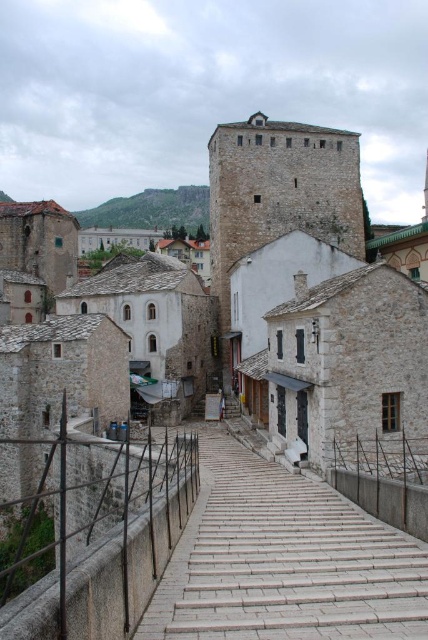
Question: Among these points, which one is nearest to the camera?

Choices:
 (A) pos(211,272)
 (B) pos(213,627)
 (C) pos(136,225)

Answer: (B)

Question: In this image, where is white stone steps at center located relative to white stone tower at center?

Choices:
 (A) below
 (B) above

Answer: (A)

Question: Can you confirm if white stone steps at center is wider than green stone cliff at upper center?

Choices:
 (A) no
 (B) yes

Answer: (A)

Question: Which point appears closest to the camera in this image?

Choices:
 (A) (279, 470)
 (B) (190, 212)

Answer: (A)

Question: Can you confirm if white stone steps at center is positioned to the left of white stone tower at center?

Choices:
 (A) no
 (B) yes

Answer: (B)

Question: Based on their relative distances, which object is farther from the white stone steps at center?

Choices:
 (A) green stone cliff at upper center
 (B) white stone tower at center

Answer: (A)